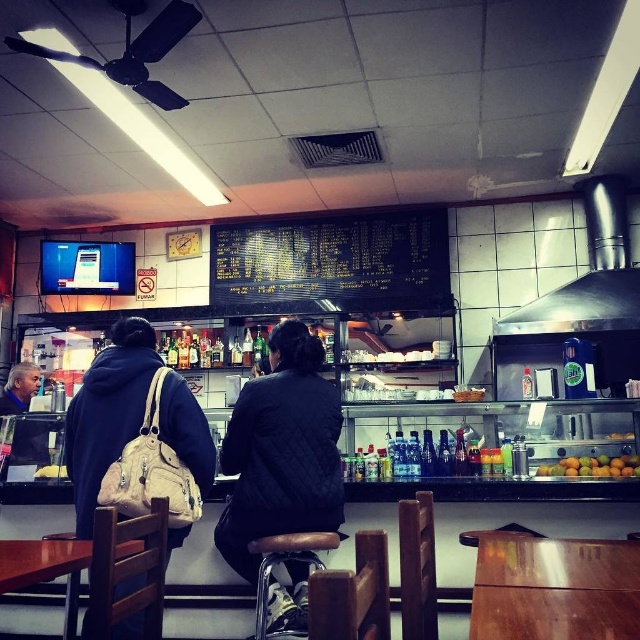
You are standing at point (x=612, y=460) and want to walk to point (x=259, y=570). Which direction should you move?

You should move forward because point (x=259, y=570) is in front of point (x=612, y=460).